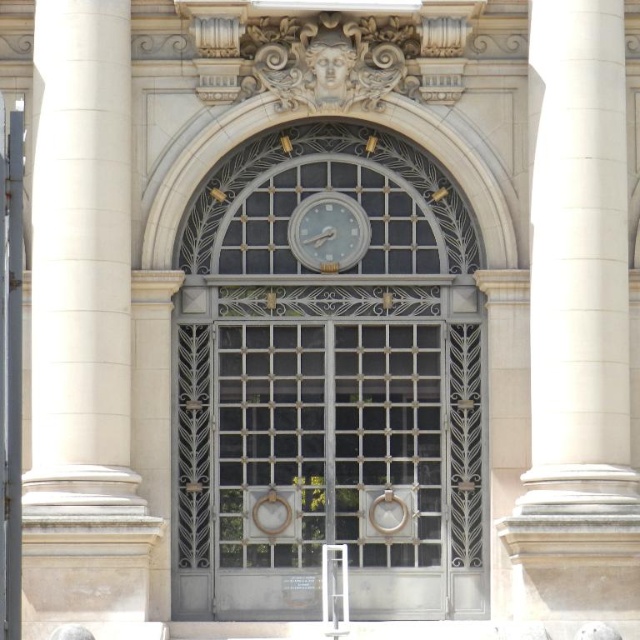
Question: Based on their relative distances, which object is nearer to the metallic gray clock at center?

Choices:
 (A) white marble column at left
 (B) white marble pillar at right
 (C) white glossy clock at upper center

Answer: (C)

Question: Is white marble pillar at right wider than white glossy clock at upper center?

Choices:
 (A) yes
 (B) no

Answer: (A)

Question: Which of these objects is positioned farthest from the metallic gray clock at center?

Choices:
 (A) white marble pillar at right
 (B) white glossy clock at upper center

Answer: (A)

Question: Can you confirm if white marble column at left is positioned to the right of white glossy clock at upper center?

Choices:
 (A) no
 (B) yes

Answer: (A)

Question: Is white marble column at left to the left of white glossy clock at upper center from the viewer's perspective?

Choices:
 (A) no
 (B) yes

Answer: (B)

Question: Which object is positioned farthest from the white marble pillar at right?

Choices:
 (A) white marble column at left
 (B) white glossy clock at upper center
 (C) metallic gray clock at center

Answer: (A)